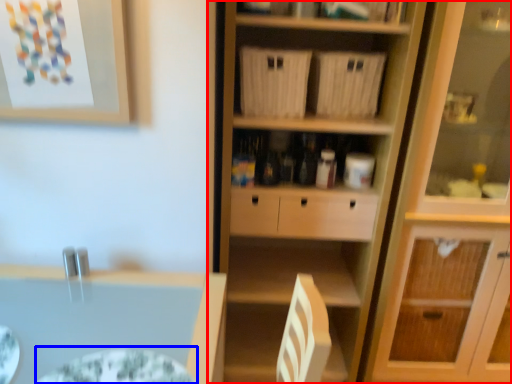
Question: Which point is closer to the camera, cupboard (highlighted by a red box) or glass plate (highlighted by a blue box)?

Choices:
 (A) cupboard
 (B) glass plate

Answer: (B)